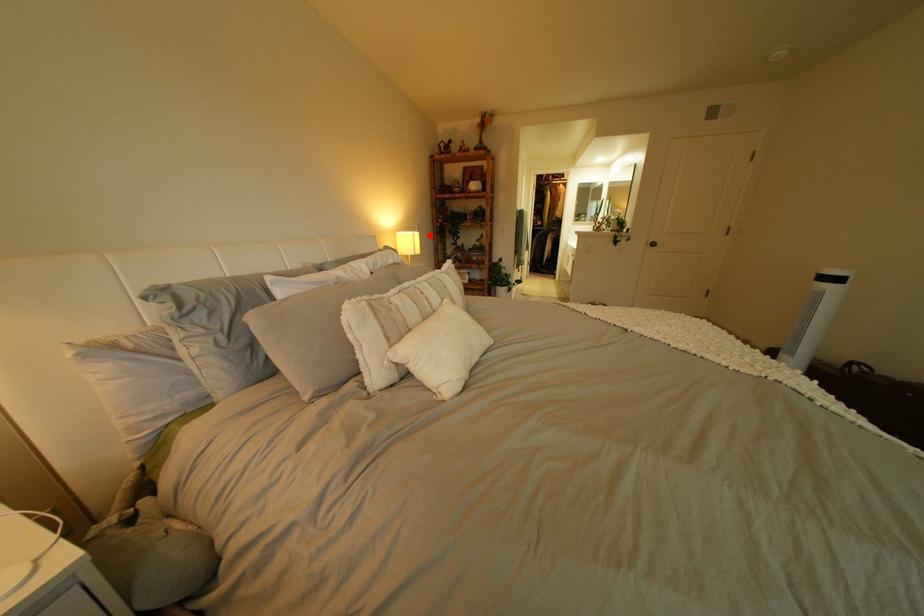
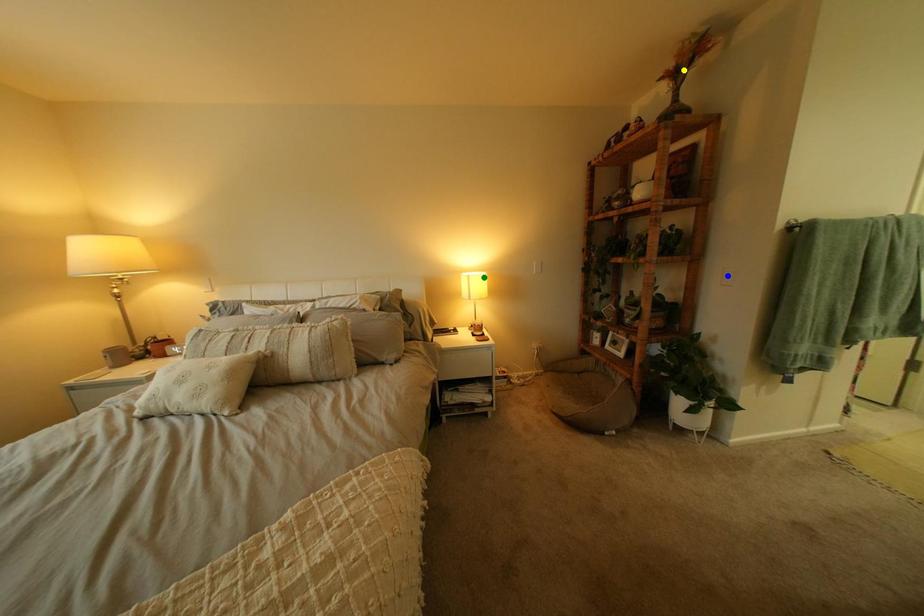
Question: I am providing you with two images of the same scene from different viewpoints. A red point is marked on the first image. You are given multiple points on the second image. In image 2, which mark is for the same physical point as the one in image 1?

Choices:
 (A) blue point
 (B) yellow point
 (C) green point

Answer: (C)